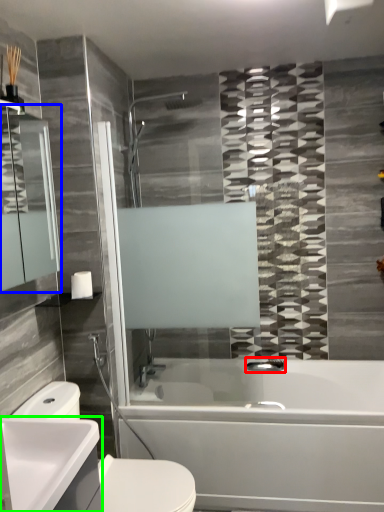
Question: Based on their relative distances, which object is farther from plumbing fixture (highlighted by a red box)? Choose from mirror (highlighted by a blue box) and counter top (highlighted by a green box).

Choices:
 (A) mirror
 (B) counter top

Answer: (A)